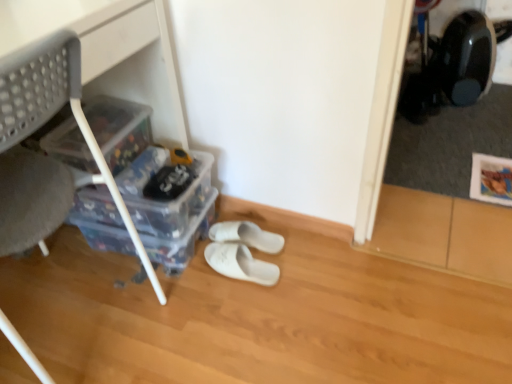
This screenshot has width=512, height=384. I want to click on empty space that is in between white plastic chair at left and white fabric slippers at center, marked as the 2th footwear in a back-to-front arrangement, so click(167, 301).